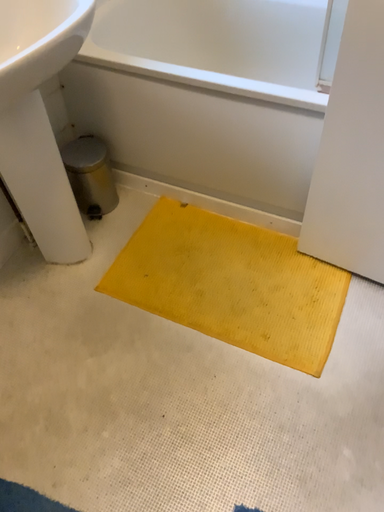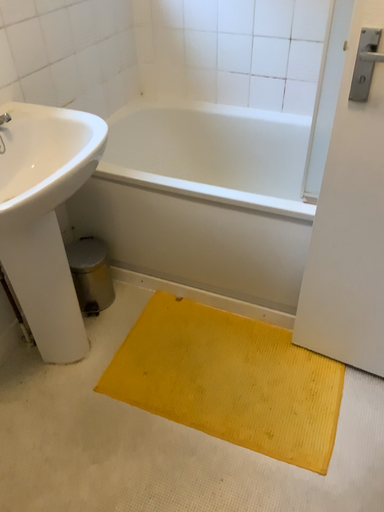
Question: How did the camera likely rotate when shooting the video?

Choices:
 (A) rotated downward
 (B) rotated upward

Answer: (B)